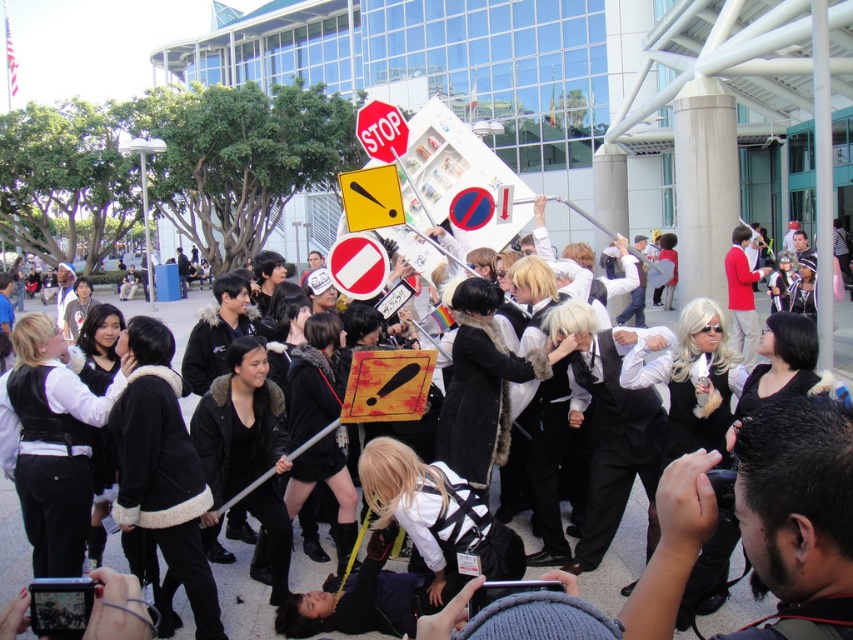
You are a photographer at the event and need to capture a clear photo of the red matte stop sign at center without any obstructions. Is the red plastic stop sign at center blocking your view of it?

The red matte stop sign at center is positioned under the red plastic stop sign at center, so the red plastic stop sign at center is blocking the view of the red matte stop sign at center. To capture a clear photo, you would need to adjust the angle or move the red plastic stop sign at center out of the way.